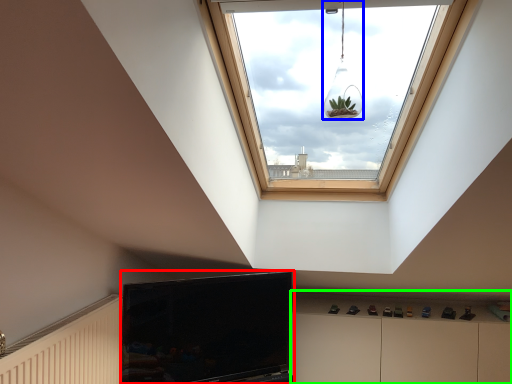
Question: Estimate the real-world distances between objects in this image. Which object is closer to television (highlighted by a red box), light fixture (highlighted by a blue box) or dresser (highlighted by a green box)?

Choices:
 (A) light fixture
 (B) dresser

Answer: (B)